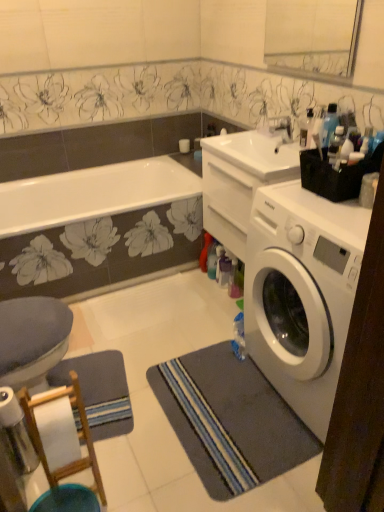
Find the location of `vacant space situated above gray striped bath mat at lower right (from a real-world perspective)`. vacant space situated above gray striped bath mat at lower right (from a real-world perspective) is located at coordinates (230, 410).